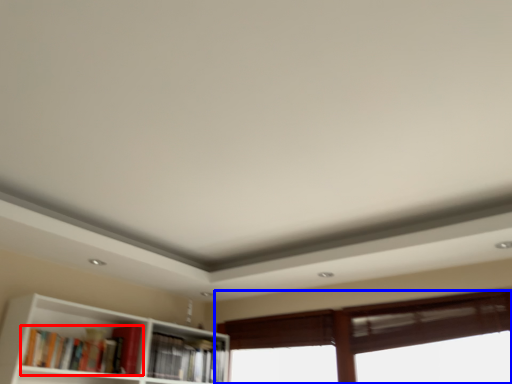
Question: Which of the following is the farthest to the observer, book (highlighted by a red box) or window (highlighted by a blue box)?

Choices:
 (A) book
 (B) window

Answer: (B)